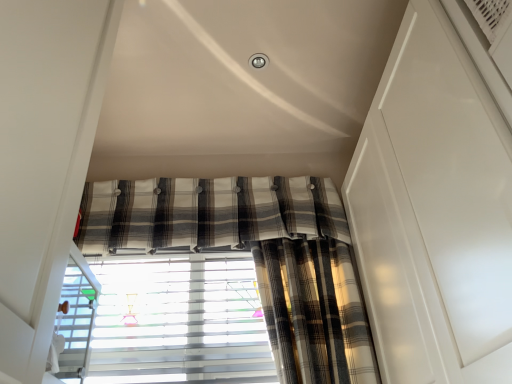
Identify the location of plaid fabric curtain at center. This screenshot has height=384, width=512. (207, 212).

This screenshot has width=512, height=384. What do you see at coordinates (207, 212) in the screenshot? I see `plaid fabric curtain at center` at bounding box center [207, 212].

Image resolution: width=512 pixels, height=384 pixels. Describe the element at coordinates (179, 321) in the screenshot. I see `white textured blinds at center` at that location.

This screenshot has height=384, width=512. Find the location of `white textured blinds at center`. white textured blinds at center is located at coordinates (179, 321).

Locate an element on the screen. The width and height of the screenshot is (512, 384). plaid fabric curtain at center is located at coordinates (207, 212).

Considering the positions of objects plaid fabric curtain at center and white textured blinds at center in the image provided, who is more to the left, plaid fabric curtain at center or white textured blinds at center?

white textured blinds at center.

Considering the relative positions of plaid fabric curtain at center and white textured blinds at center in the image provided, is plaid fabric curtain at center in front of white textured blinds at center?

No, plaid fabric curtain at center is behind white textured blinds at center.

Does point (108, 226) come farther from viewer compared to point (250, 269)?

No, (108, 226) is in front of (250, 269).

From the image's perspective, which one is positioned lower, plaid fabric curtain at center or white textured blinds at center?

white textured blinds at center, from the image's perspective.

From a real-world perspective, between plaid fabric curtain at center and white textured blinds at center, who is vertically higher?

plaid fabric curtain at center is physically above.

Looking at this image, considering the relative sizes of plaid fabric curtain at center and white textured blinds at center in the image provided, is plaid fabric curtain at center wider than white textured blinds at center?

Correct, the width of plaid fabric curtain at center exceeds that of white textured blinds at center.

Does plaid fabric curtain at center have a lesser height compared to white textured blinds at center?

Yes.

Based on the photo, considering the relative sizes of plaid fabric curtain at center and white textured blinds at center in the image provided, is plaid fabric curtain at center bigger than white textured blinds at center?

Yes, plaid fabric curtain at center is bigger than white textured blinds at center.

Is plaid fabric curtain at center positioned beyond the bounds of white textured blinds at center?

Indeed, plaid fabric curtain at center is completely outside white textured blinds at center.

Is plaid fabric curtain at center in contact with white textured blinds at center?

They are not placed beside each other.

Is white textured blinds at center at the back of plaid fabric curtain at center?

No, plaid fabric curtain at center is not facing away from white textured blinds at center.

Can you tell me how much plaid fabric curtain at center and white textured blinds at center differ in facing direction?

0.000739 degrees separate the facing orientations of plaid fabric curtain at center and white textured blinds at center.

Where is `curtain on the right of white textured blinds at center`? The height and width of the screenshot is (384, 512). curtain on the right of white textured blinds at center is located at coordinates (207, 212).

Which is more to the right, white textured blinds at center or plaid fabric curtain at center?

From the viewer's perspective, plaid fabric curtain at center appears more on the right side.

Considering the relative positions of white textured blinds at center and plaid fabric curtain at center in the image provided, is white textured blinds at center in front of plaid fabric curtain at center?

Yes, white textured blinds at center is in front of plaid fabric curtain at center.

Which point is more forward, (198, 314) or (328, 195)?

The point (198, 314) is in front.

Looking at this image, from the image's perspective, is white textured blinds at center above plaid fabric curtain at center?

No, from the image's perspective, white textured blinds at center is not on top of plaid fabric curtain at center.

From a real-world perspective, which object stands above the other?

plaid fabric curtain at center.

Which object is thinner, white textured blinds at center or plaid fabric curtain at center?

white textured blinds at center is thinner.

In terms of height, does white textured blinds at center look taller or shorter compared to plaid fabric curtain at center?

In the image, white textured blinds at center appears to be taller than plaid fabric curtain at center.

Considering the sizes of white textured blinds at center and plaid fabric curtain at center in the image, is white textured blinds at center bigger or smaller than plaid fabric curtain at center?

white textured blinds at center is smaller than plaid fabric curtain at center.

Is white textured blinds at center not within plaid fabric curtain at center?

Yes, white textured blinds at center is located beyond the bounds of plaid fabric curtain at center.

Is white textured blinds at center far from plaid fabric curtain at center?

white textured blinds at center is near plaid fabric curtain at center, not far away.

Is white textured blinds at center facing towards plaid fabric curtain at center?

No.

How far apart are white textured blinds at center and plaid fabric curtain at center?

white textured blinds at center is 28.04 centimeters from plaid fabric curtain at center.

Find the location of a particular element. The height and width of the screenshot is (384, 512). window blind in front of the plaid fabric curtain at center is located at coordinates (179, 321).

In the image, there is a white textured blinds at center. Where is `curtain above it (from the image's perspective)`? curtain above it (from the image's perspective) is located at coordinates (207, 212).

The width and height of the screenshot is (512, 384). Identify the location of curtain that is on the right side of white textured blinds at center. (207, 212).